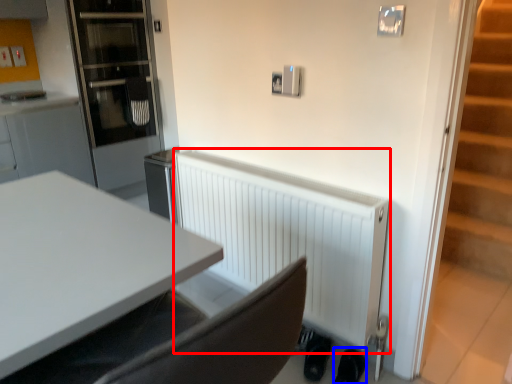
Question: Which of the following is the farthest to the observer, radiator (highlighted by a red box) or shoe (highlighted by a blue box)?

Choices:
 (A) radiator
 (B) shoe

Answer: (B)